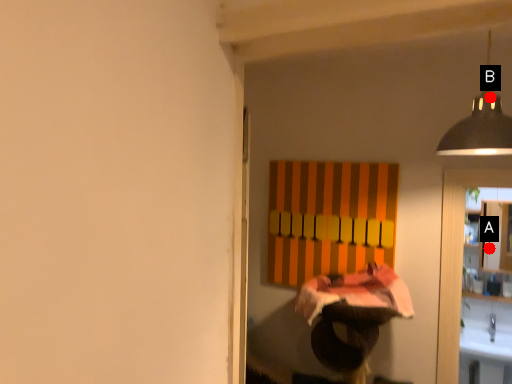
Question: Two points are circled on the image, labeled by A and B beside each circle. Which point is further to the camera?

Choices:
 (A) A is further
 (B) B is further

Answer: (A)